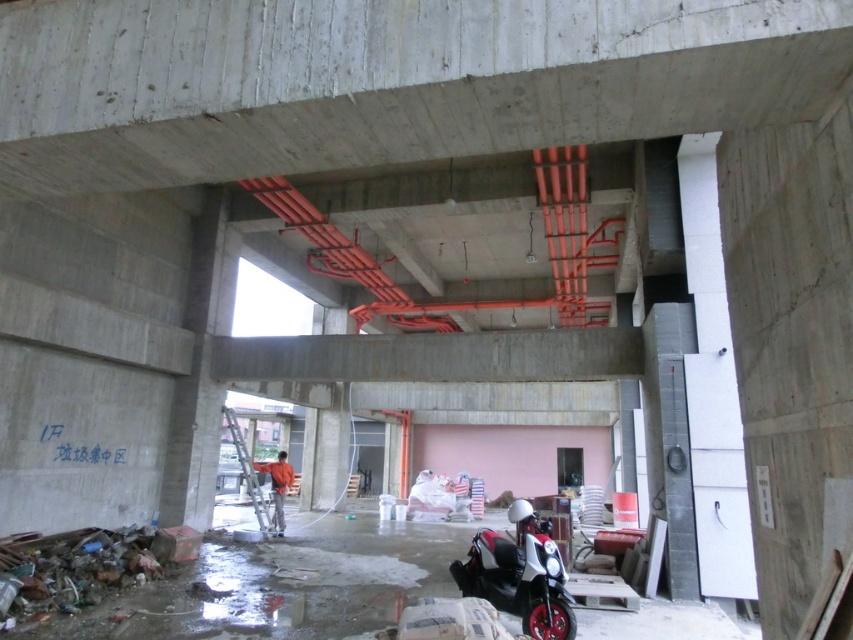
You are a construction worker carrying a heavy tool box. You need to move from the entrance to the storage area located behind the white glossy scooter at center and the orange fabric man at center. Which object should you avoid stepping around to ensure you have enough space to pass safely?

You should avoid stepping around the orange fabric man at center because the white glossy scooter at center is thinner, so the orange fabric man at center takes up more space, making it the object you need to avoid to pass safely.